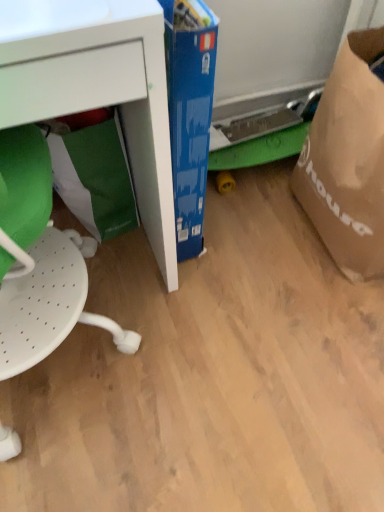
Find the location of a particular element. This screenshot has width=384, height=512. free point below white perforated swivel chair at left (from a real-world perspective) is located at coordinates (75, 371).